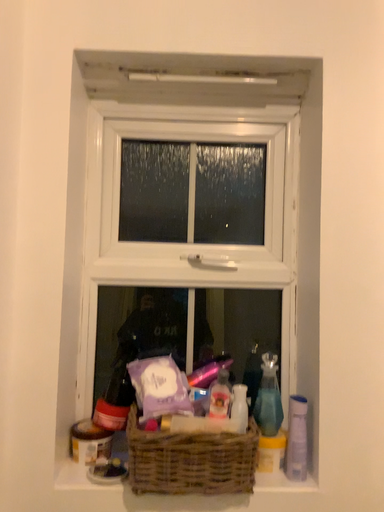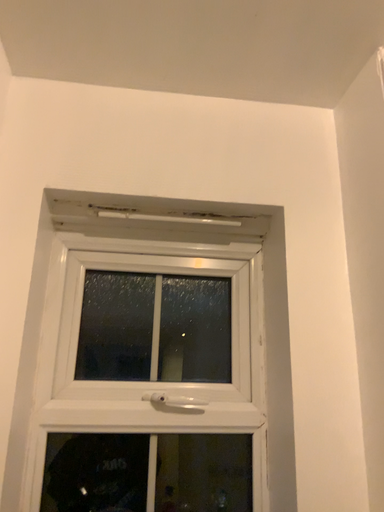
Question: How did the camera likely rotate when shooting the video?

Choices:
 (A) rotated downward
 (B) rotated upward

Answer: (B)